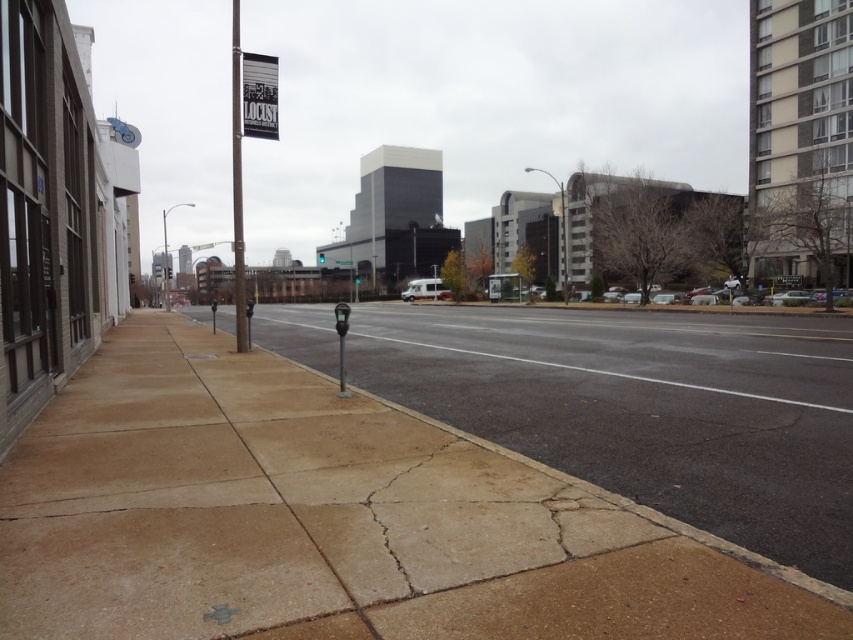
Question: Among these points, which one is farthest from the camera?

Choices:
 (A) (339, 259)
 (B) (184, 369)
 (C) (260, 131)

Answer: (A)

Question: Which is nearer to the metallic pole at center?

Choices:
 (A) metallic gray parking meter at center
 (B) brown concrete sidewalk at lower left
 (C) matte white van at center

Answer: (B)

Question: Considering the real-world distances, which object is farthest from the metallic pole at center?

Choices:
 (A) brown concrete sidewalk at lower left
 (B) metallic gray parking meter at center

Answer: (B)

Question: Is metallic pole at center below metallic gray parking meter at lower left?

Choices:
 (A) no
 (B) yes

Answer: (A)

Question: Can you confirm if white plastic banner at upper center is thinner than metallic gray parking meter at center?

Choices:
 (A) yes
 (B) no

Answer: (A)

Question: Is matte white van at center to the right of metallic gray parking meter at center-left from the viewer's perspective?

Choices:
 (A) yes
 (B) no

Answer: (A)